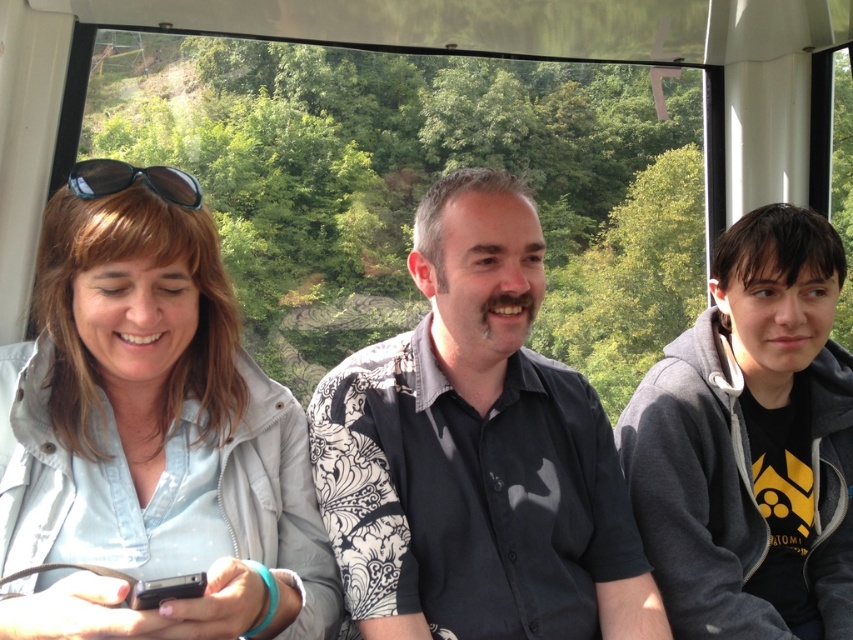
You are designing a storage compartment for the cable car that needs to accommodate both the light blue denim jacket at left and the gray hoodie at right. Which jacket requires a wider storage space?

The light blue denim jacket at left requires a wider storage space because its width is larger than the gray hoodie at right.

You are a fashion designer observing the clothing items in the cable car. Which clothing item, the light blue denim jacket at left or the gray hoodie at right, would you recommend for someone who wants a more voluminous look?

The light blue denim jacket at left is larger in size than the gray hoodie at right, so it would be the better choice for a more voluminous look.

From the picture: You are a tailor who needs to determine which jacket requires a taller hanger. Based on the image, which one between the light blue denim jacket at left and the gray hoodie at right needs a taller hanger?

The gray hoodie at right needs a taller hanger because the light blue denim jacket at left is not as tall as gray hoodie at right.